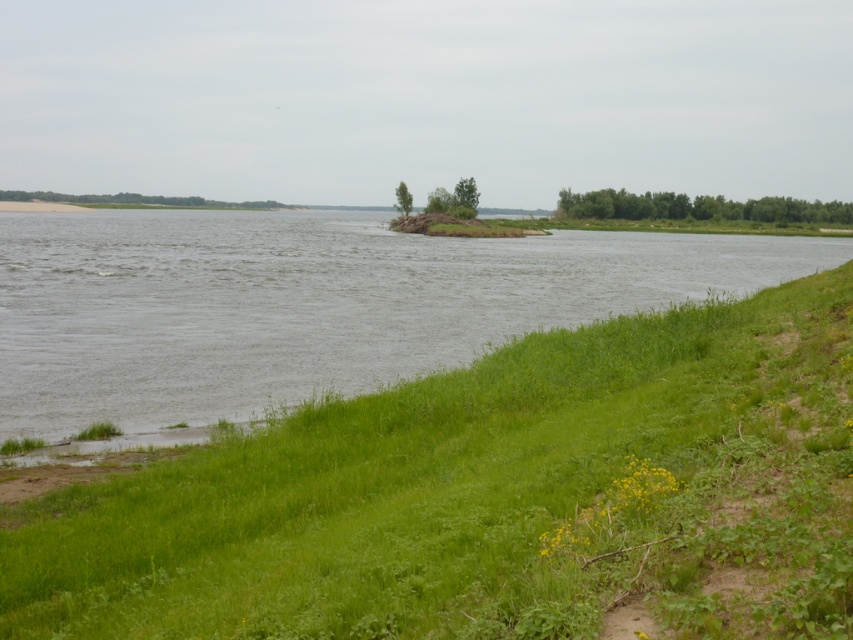
You are standing at the center of the image. Which direction should you walk to reach the green grassy at lower left?

You should walk towards the lower left direction to reach the green grassy at lower left.